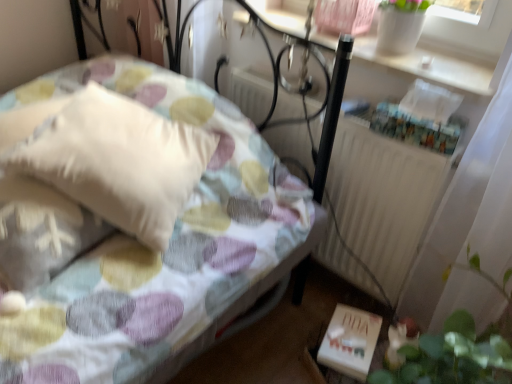
Identify the location of free spot above white ceramic vase at upper right (from a real-world perspective). The height and width of the screenshot is (384, 512). (391, 54).